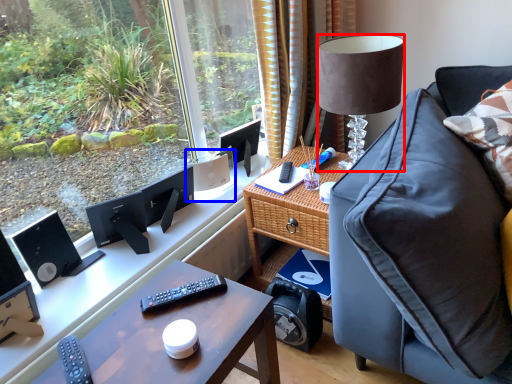
Question: Which object appears farthest to the camera in this image, lamp (highlighted by a red box) or speaker (highlighted by a blue box)?

Choices:
 (A) lamp
 (B) speaker

Answer: (B)